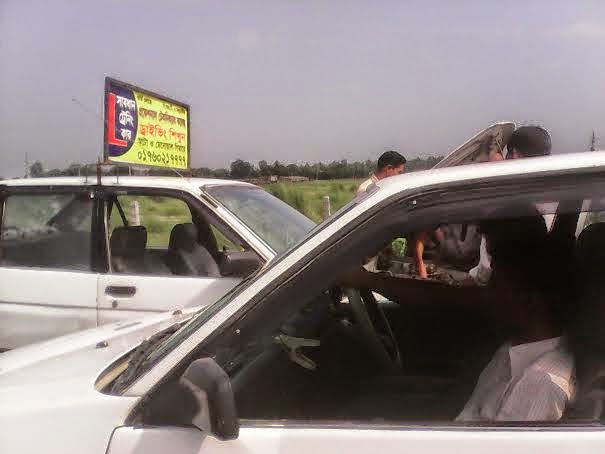
Identify the location of door handle. (117, 289).